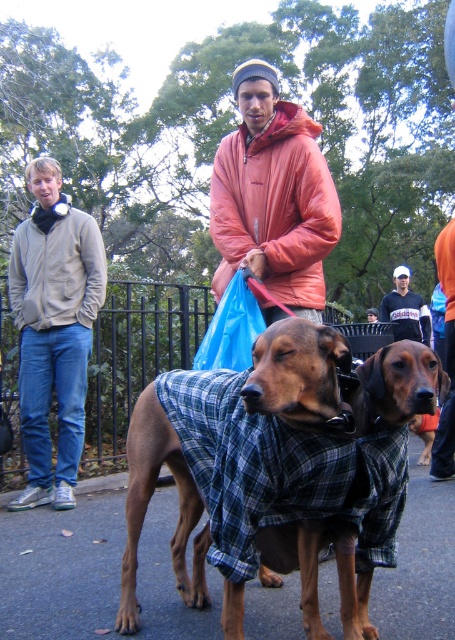
You are a photographer trying to capture a photo of the orange puffy jacket at center and the brown plaid coat at center. Which one is on the left side when facing the jackets?

The orange puffy jacket at center is positioned on the left side of the brown plaid coat at center, so when facing the jackets, the orange puffy jacket at center is on the left side.

You are a photographer wanting to capture both the brown plaid coat at center and the brushed metal jacket at left in a single shot. Which object should you focus on first to ensure both are in clear view?

The brown plaid coat at center is closer to the viewer than the brushed metal jacket at left, so focusing on the brown plaid coat at center first will help keep both objects in clear focus.

Based on the photo, you are a photographer trying to capture both the brown plaid coat at center and the brushed metal jacket at left in a single frame. Which object should you focus on first to ensure both fit in the photo?

You should focus on the brushed metal jacket at left first because it occupies more space than the brown plaid coat at center, ensuring both fit in the photo.